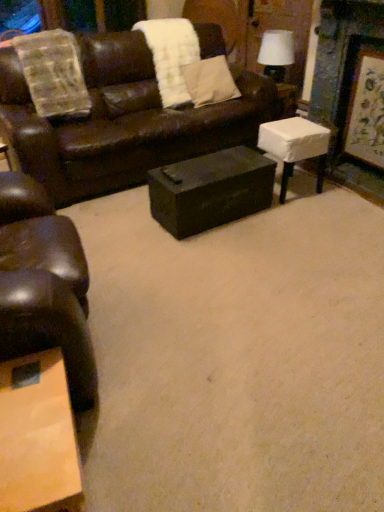
This screenshot has width=384, height=512. Find the location of `empty space that is in between shiny brown leather chair at left and matte black trunk at center, positioned as the 1th table in left-to-right order`. empty space that is in between shiny brown leather chair at left and matte black trunk at center, positioned as the 1th table in left-to-right order is located at coordinates (156, 284).